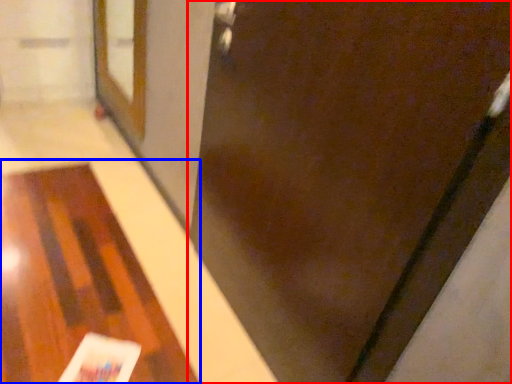
Question: Which object is further to the camera taking this photo, door (highlighted by a red box) or table (highlighted by a blue box)?

Choices:
 (A) door
 (B) table

Answer: (B)